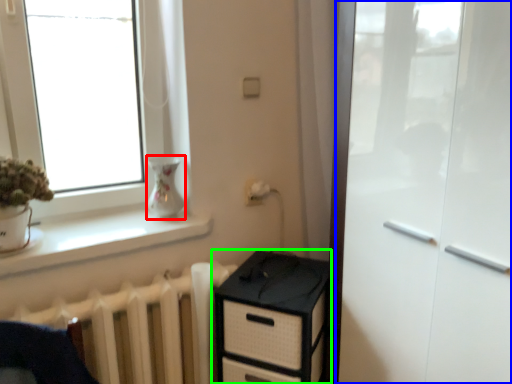
Question: Estimate the real-world distances between objects in this image. Which object is closer to vase (highlighted by a red box), screen door (highlighted by a blue box) or chest of drawers (highlighted by a green box)?

Choices:
 (A) screen door
 (B) chest of drawers

Answer: (B)